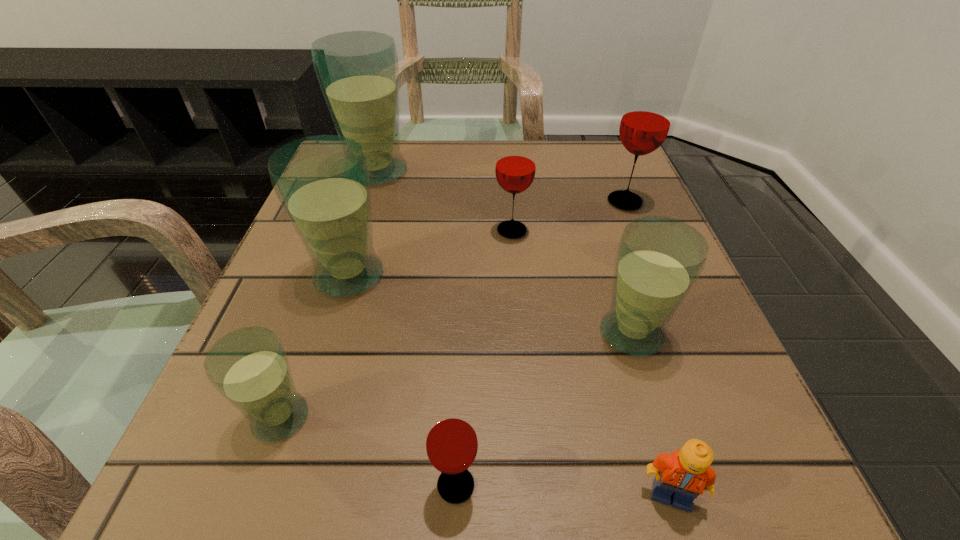
Where is `the tallest glass`? This screenshot has height=540, width=960. the tallest glass is located at coordinates (358, 72).

I want to click on the farthest blue glass, so click(x=358, y=72).

Find the location of a particular element. This screenshot has height=540, width=960. the farthest red glass is located at coordinates click(646, 119).

At what (x,y) coordinates should I click in order to perform the action: click on the biggest red glass. Please return your answer as a coordinate pair (x, y). Looking at the image, I should click on (646, 119).

Locate an element on the screen. The width and height of the screenshot is (960, 540). the fourth farthest object is located at coordinates (322, 182).

Find the location of a particular element. the third nearest blue glass is located at coordinates (322, 182).

Where is `the third farthest object`? the third farthest object is located at coordinates (515, 168).

At what (x,y) coordinates should I click in order to perform the action: click on the fifth nearest glass. Please return your answer as a coordinate pair (x, y). Looking at the image, I should click on (515, 168).

Identify the location of the rightmost blue glass. (659, 259).

At what (x,y) coordinates should I click in order to perform the action: click on the third nearest glass. Please return your answer as a coordinate pair (x, y). The height and width of the screenshot is (540, 960). Looking at the image, I should click on click(659, 259).